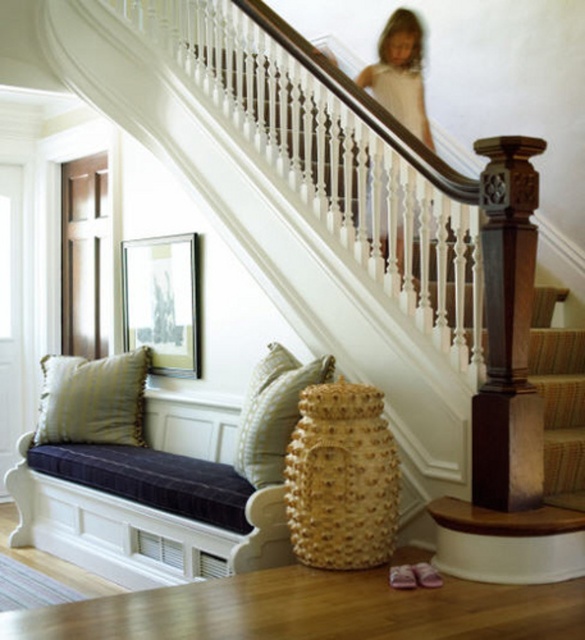
You are standing at the bottom of the staircase in this elegant interior. You see the velvet blue bench at lower left and the textured beige pillow at center. Which object is closer to you from your current position?

The velvet blue bench at lower left is closer to you because it is in front of the textured beige pillow at center.

You are standing at the bottom of the staircase and want to place a small plant between the dark wood post at center and the textured beige pillow at center. Based on their positions, which object should the plant be closer to?

→ The dark wood post at center is in front of the textured beige pillow at center, so the plant should be placed closer to the textured beige pillow at center to ensure it is visible behind the post.

You are designing a seating arrangement and want to place a small side table between the dark wood post at center and the textured beige pillow at center. Which object should the table be closer to if it needs to accommodate the size of the objects?

The dark wood post at center has a smaller size compared to the textured beige pillow at center, so the table should be placed closer to the dark wood post at center to account for its smaller size.